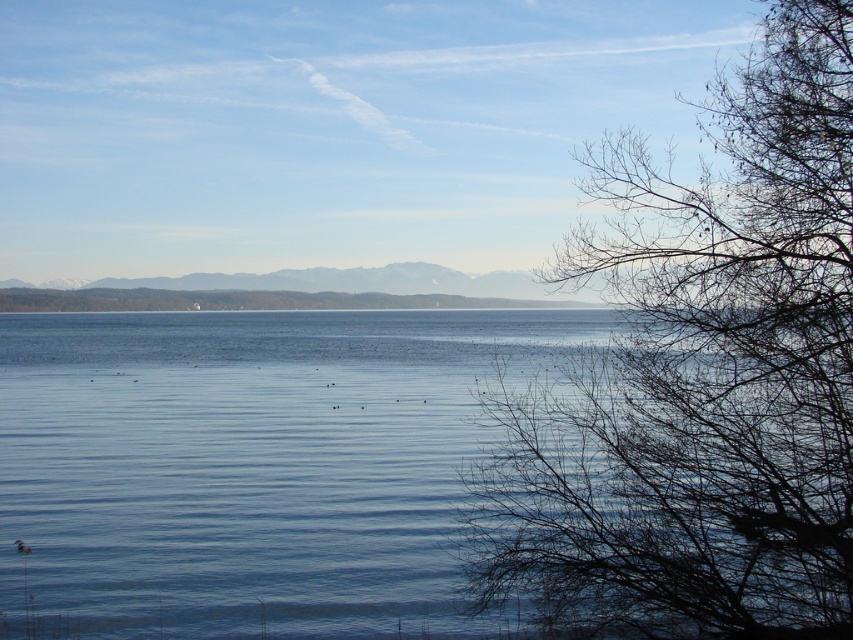
Does bare branches at right have a larger size compared to blue water at center?

Actually, bare branches at right might be smaller than blue water at center.

Which is more to the right, bare branches at right or blue water at center?

bare branches at right is more to the right.

Where is `bare branches at right`? This screenshot has width=853, height=640. bare branches at right is located at coordinates (701, 380).